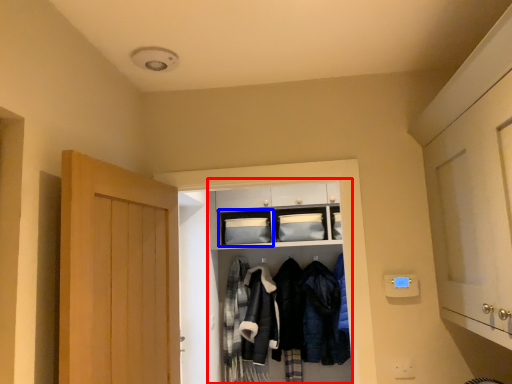
Question: Which of the following is the farthest to the observer, closet (highlighted by a red box) or shelf (highlighted by a blue box)?

Choices:
 (A) closet
 (B) shelf

Answer: (B)